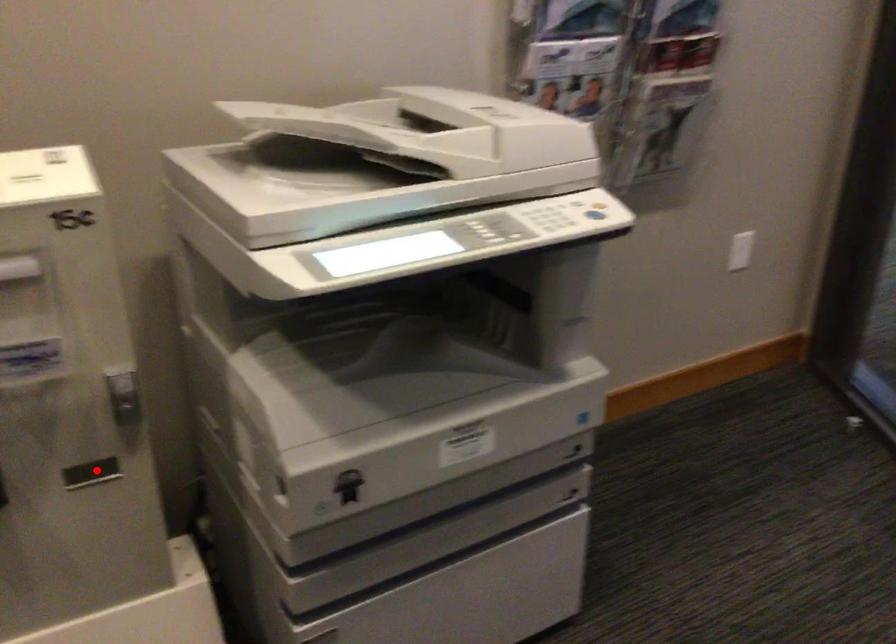
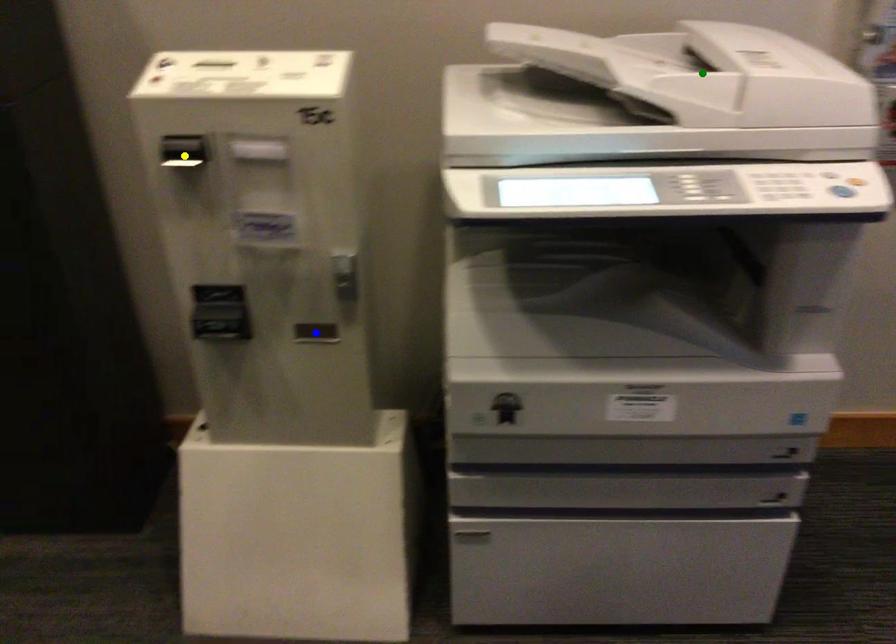
Question: I am providing you with two images of the same scene from different viewpoints. A red point is marked on the first image. You are given multiple points on the second image. Can you choose the point in image 2 that corresponds to the point in image 1?

Choices:
 (A) yellow point
 (B) blue point
 (C) green point

Answer: (B)